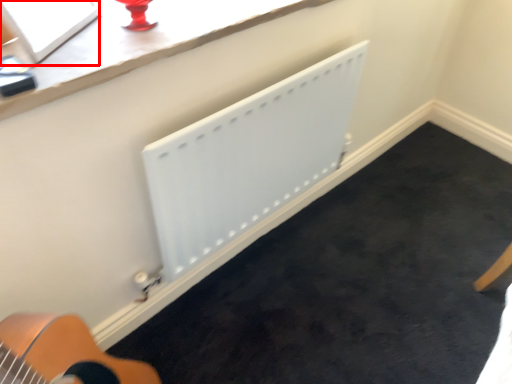
Question: From the image's perspective, what is the correct spatial positioning of window screen (annotated by the red box) in reference to radiator?

Choices:
 (A) above
 (B) below

Answer: (A)